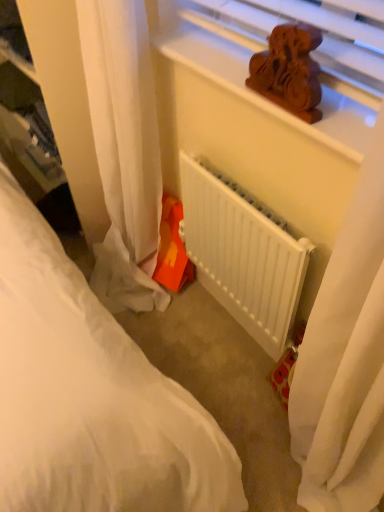
Locate an element on the screen. The height and width of the screenshot is (512, 384). vacant space situated above wooden carving at upper center (from a real-world perspective) is located at coordinates (243, 66).